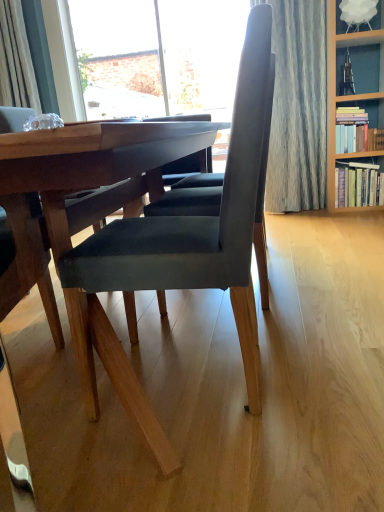
What do you see at coordinates (119, 57) in the screenshot?
I see `brick wall at upper left` at bounding box center [119, 57].

You are a GUI agent. You are given a task and a screenshot of the screen. Output one action in this format:
    pyautogui.click(x=<x>, y=<y>)
    Task: Click on the hardcover book at right, the second book in the top-to-bottom sequence
    The height and width of the screenshot is (512, 384).
    Given the screenshot: What is the action you would take?
    pyautogui.click(x=358, y=185)

Describe the element at coordinates (356, 131) in the screenshot. I see `hardcover books at upper right, arranged as the 2th book when ordered from the bottom` at that location.

Identify the location of velvet dark gray chair at center. This screenshot has height=512, width=384. (172, 255).

Where is `brick wall at upper left`? The image size is (384, 512). brick wall at upper left is located at coordinates (119, 57).

From the image's perspective, relative to velvet dark gray chair at center, is brick wall at upper left above or below?

From the image's perspective, brick wall at upper left appears above velvet dark gray chair at center.

There is a velvet dark gray chair at center. At what (x,y) coordinates should I click in order to perform the action: click on window above it (from a real-world perspective). Please return your answer as a coordinate pair (x, y). Image resolution: width=384 pixels, height=512 pixels. Looking at the image, I should click on (119, 57).

Considering the points (198, 30) and (239, 274), which point is in front, point (198, 30) or point (239, 274)?

Point (239, 274)

Does hardcover books at upper right, arranged as the 2th book when ordered from the bottom, have a smaller size compared to hardcover book at right, the second book in the top-to-bottom sequence?

Yes.

From the picture: How different are the orientations of hardcover books at upper right, the 1th book from the top, and hardcover book at right, the second book in the top-to-bottom sequence, in degrees?

0.000119 degrees.

Choose the correct answer: Is hardcover books at upper right, arranged as the 2th book when ordered from the bottom, inside hardcover book at right, the second book in the top-to-bottom sequence, or outside it?

hardcover books at upper right, arranged as the 2th book when ordered from the bottom, is not enclosed by hardcover book at right, the second book in the top-to-bottom sequence.

Can you confirm if hardcover books at upper right, the 1th book from the top, is positioned to the right of hardcover book at right, the 1th book from the bottom?

No, hardcover books at upper right, the 1th book from the top, is not to the right of hardcover book at right, the 1th book from the bottom.

Where is `chair that appears on the left of hardcover books at upper right, the 1th book from the top`? The height and width of the screenshot is (512, 384). chair that appears on the left of hardcover books at upper right, the 1th book from the top is located at coordinates (172, 255).

From a real-world perspective, does hardcover books at upper right, arranged as the 2th book when ordered from the bottom, sit lower than velvet dark gray chair at center?

Incorrect, from a real-world perspective, hardcover books at upper right, arranged as the 2th book when ordered from the bottom, is higher than velvet dark gray chair at center.

Can you tell me how much hardcover books at upper right, the 1th book from the top, and velvet dark gray chair at center differ in facing direction?

90.4 degrees.

From the image's perspective, which book is the 1st one above the velvet dark gray chair at center? Please provide its 2D coordinates.

[(358, 185)]

Is hardcover book at right, the 1th book from the bottom, inside the boundaries of velvet dark gray chair at center, or outside?

hardcover book at right, the 1th book from the bottom, is not inside velvet dark gray chair at center, it's outside.

Considering the relative sizes of hardcover book at right, the 1th book from the bottom, and velvet dark gray chair at center in the image provided, is hardcover book at right, the 1th book from the bottom, taller than velvet dark gray chair at center?

In fact, hardcover book at right, the 1th book from the bottom, may be shorter than velvet dark gray chair at center.

Does point (376, 184) come closer to viewer compared to point (117, 223)?

No, (376, 184) is behind (117, 223).

Is brick wall at upper left wider or thinner than hardcover books at upper right, arranged as the 2th book when ordered from the bottom?

In the image, brick wall at upper left appears to be more narrow than hardcover books at upper right, arranged as the 2th book when ordered from the bottom.

Is brick wall at upper left positioned in front of hardcover books at upper right, the 1th book from the top?

No, brick wall at upper left is further to the viewer.

Looking at this image, from the image's perspective, would you say brick wall at upper left is positioned over hardcover books at upper right, the 1th book from the top?

Yes, from the image's perspective, brick wall at upper left is on top of hardcover books at upper right, the 1th book from the top.

From the image's perspective, is hardcover book at right, the 1th book from the bottom, under hardcover books at upper right, arranged as the 2th book when ordered from the bottom?

Correct, hardcover book at right, the 1th book from the bottom, appears lower than hardcover books at upper right, arranged as the 2th book when ordered from the bottom, in the image.

Is hardcover book at right, the 1th book from the bottom, bigger than hardcover books at upper right, arranged as the 2th book when ordered from the bottom?

Yes, hardcover book at right, the 1th book from the bottom, is bigger than hardcover books at upper right, arranged as the 2th book when ordered from the bottom.

From a real-world perspective, between hardcover book at right, the second book in the top-to-bottom sequence, and hardcover books at upper right, the 1th book from the top, who is vertically lower?

From a 3D spatial view, hardcover book at right, the second book in the top-to-bottom sequence, is below.

Does point (88, 329) lie behind point (125, 52)?

No, it is not.

Considering the positions of objects velvet dark gray chair at center and brick wall at upper left in the image provided, who is more to the left, velvet dark gray chair at center or brick wall at upper left?

From the viewer's perspective, brick wall at upper left appears more on the left side.

Is velvet dark gray chair at center next to brick wall at upper left and touching it?

They are not placed beside each other.

From the image's perspective, is velvet dark gray chair at center on brick wall at upper left?

No, from the image's perspective, velvet dark gray chair at center is not on top of brick wall at upper left.

I want to click on chair that appears below the brick wall at upper left (from the image's perspective), so click(x=172, y=255).

Where is `book that appears in front of the hardcover book at right, the second book in the top-to-bottom sequence`? book that appears in front of the hardcover book at right, the second book in the top-to-bottom sequence is located at coordinates (356, 131).

Based on the photo, based on their spatial positions, is brick wall at upper left or hardcover books at upper right, arranged as the 2th book when ordered from the bottom, further from velvet dark gray chair at center?

brick wall at upper left is further to velvet dark gray chair at center.

Estimate the real-world distances between objects in this image. Which object is further from velvet dark gray chair at center, hardcover books at upper right, the 1th book from the top, or hardcover book at right, the second book in the top-to-bottom sequence?

Among the two, hardcover books at upper right, the 1th book from the top, is located further to velvet dark gray chair at center.

Based on their spatial positions, is hardcover books at upper right, the 1th book from the top, or velvet dark gray chair at center further from hardcover book at right, the second book in the top-to-bottom sequence?

Among the two, velvet dark gray chair at center is located further to hardcover book at right, the second book in the top-to-bottom sequence.

Considering their positions, is velvet dark gray chair at center positioned further to hardcover books at upper right, arranged as the 2th book when ordered from the bottom, than brick wall at upper left?

Among the two, velvet dark gray chair at center is located further to hardcover books at upper right, arranged as the 2th book when ordered from the bottom.

When comparing their distances from brick wall at upper left, does hardcover book at right, the 1th book from the bottom, or velvet dark gray chair at center seem closer?

The object closer to brick wall at upper left is hardcover book at right, the 1th book from the bottom.

From the picture: From the image, which object appears to be nearer to hardcover books at upper right, the 1th book from the top, hardcover book at right, the second book in the top-to-bottom sequence, or velvet dark gray chair at center?

Based on the image, hardcover book at right, the second book in the top-to-bottom sequence, appears to be nearer to hardcover books at upper right, the 1th book from the top.

Which object lies further to the anchor point brick wall at upper left, velvet dark gray chair at center or hardcover books at upper right, the 1th book from the top?

velvet dark gray chair at center lies further to brick wall at upper left than the other object.

Estimate the real-world distances between objects in this image. Which object is closer to hardcover book at right, the second book in the top-to-bottom sequence, velvet dark gray chair at center or hardcover books at upper right, the 1th book from the top?

hardcover books at upper right, the 1th book from the top.

Find the location of a particular element. The width and height of the screenshot is (384, 512). book between velvet dark gray chair at center and hardcover book at right, the second book in the top-to-bottom sequence, from front to back is located at coordinates (356, 131).

The height and width of the screenshot is (512, 384). What are the coordinates of `book between brick wall at upper left and hardcover book at right, the second book in the top-to-bottom sequence, from left to right` in the screenshot? It's located at (356, 131).